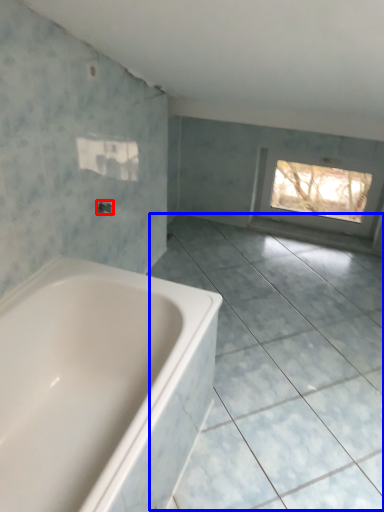
Question: Which object appears farthest to the camera in this image, tap (highlighted by a red box) or ceramic tile (highlighted by a blue box)?

Choices:
 (A) tap
 (B) ceramic tile

Answer: (A)